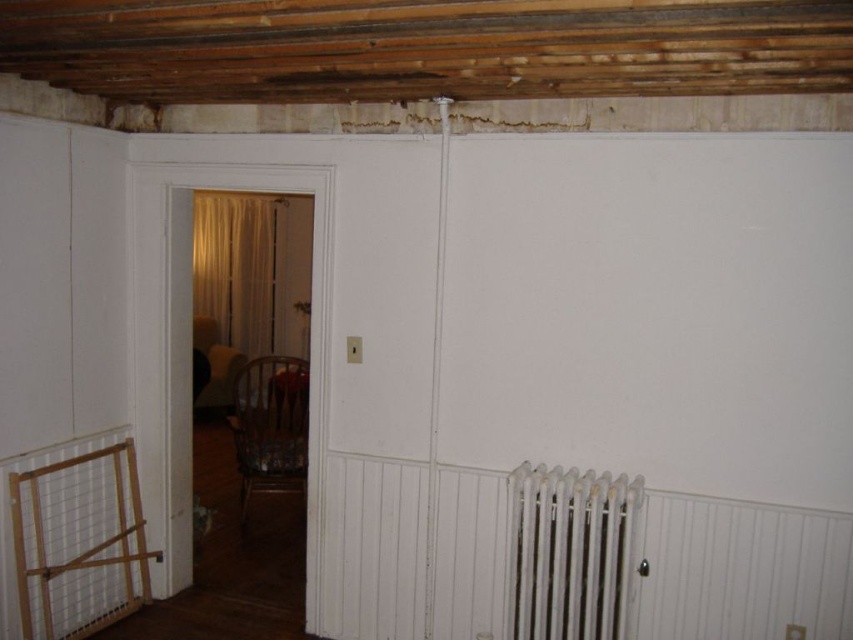
Between point (560, 557) and point (196, 285), which one is positioned in front?

Point (560, 557)

Between white metal radiator at lower right and beige sheer curtain at center, which one is positioned lower?

white metal radiator at lower right is lower down.

Who is more distant from viewer, (590, 595) or (245, 326)?

Point (245, 326)

Image resolution: width=853 pixels, height=640 pixels. Find the location of `white metal radiator at lower right`. white metal radiator at lower right is located at coordinates (570, 552).